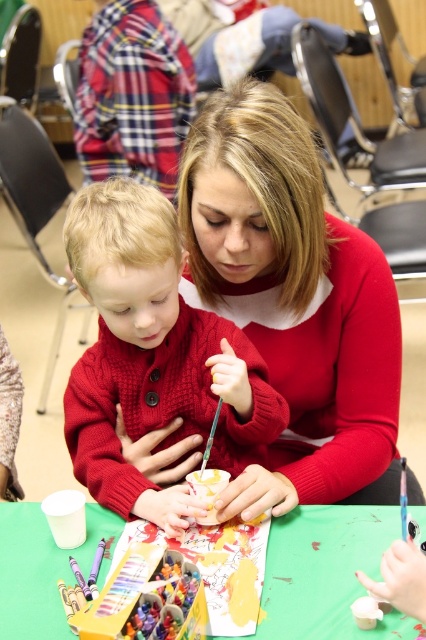
Who is higher up, matte red sweater at center or cable-knit sweater at center?

matte red sweater at center

Does point (347, 486) lie in front of point (181, 387)?

Yes, it is.

Where is `matte red sweater at center`? Image resolution: width=426 pixels, height=640 pixels. matte red sweater at center is located at coordinates (293, 300).

This screenshot has height=640, width=426. Identify the location of matte red sweater at center. (293, 300).

This screenshot has height=640, width=426. Describe the element at coordinates (293, 300) in the screenshot. I see `matte red sweater at center` at that location.

Image resolution: width=426 pixels, height=640 pixels. What do you see at coordinates (293, 300) in the screenshot?
I see `matte red sweater at center` at bounding box center [293, 300].

You are a GUI agent. You are given a task and a screenshot of the screen. Output one action in this format:
    pyautogui.click(x=<x>, y=<y>)
    Task: Click on the matte red sweater at center
    
    Given the screenshot: What is the action you would take?
    (x=293, y=300)

Is point (213, 403) positioned before point (345, 616)?

No, (213, 403) is further to viewer.

Does cable-knit sweater at center have a smaller size compared to green paper at center?

Incorrect, cable-knit sweater at center is not smaller in size than green paper at center.

Where is `cable-knit sweater at center`? This screenshot has width=426, height=640. cable-knit sweater at center is located at coordinates (152, 355).

This screenshot has height=640, width=426. What are the coordinates of `cable-knit sweater at center` in the screenshot? It's located at (152, 355).